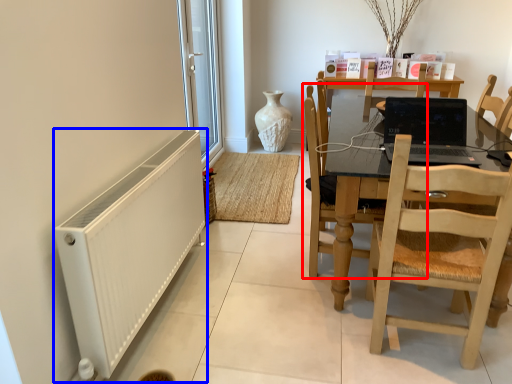
Question: Which point is further to the camera, chair (highlighted by a red box) or radiator (highlighted by a blue box)?

Choices:
 (A) chair
 (B) radiator

Answer: (A)